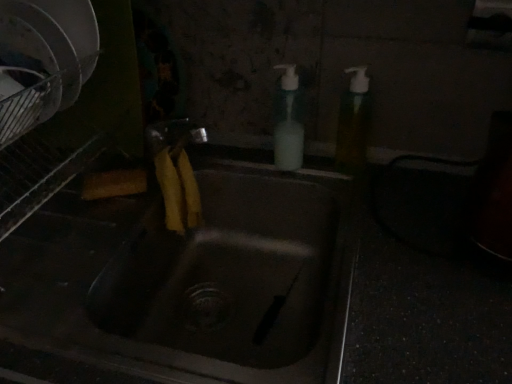
What is the approximate width of translucent plastic soap dispenser at upper right, marked as the 1th soap dispenser in a right-to-left arrangement?

It is 5.98 centimeters.

Image resolution: width=512 pixels, height=384 pixels. In order to click on matte stainless steel sink at center in this screenshot , I will do `click(192, 277)`.

Where is `translucent plastic soap dispenser at upper right, marked as the 1th soap dispenser in a right-to-left arrangement`? This screenshot has width=512, height=384. translucent plastic soap dispenser at upper right, marked as the 1th soap dispenser in a right-to-left arrangement is located at coordinates (353, 123).

Between white plastic soap dispenser at upper center, which appears as the 2th soap dispenser when viewed from the right, and translucent plastic soap dispenser at upper right, which appears as the second soap dispenser when viewed from the left, which one has larger width?

Wider between the two is translucent plastic soap dispenser at upper right, which appears as the second soap dispenser when viewed from the left.

Could you tell me if white plastic soap dispenser at upper center, which appears as the 2th soap dispenser when viewed from the right, is turned towards translucent plastic soap dispenser at upper right, which appears as the second soap dispenser when viewed from the left?

No, white plastic soap dispenser at upper center, which appears as the 2th soap dispenser when viewed from the right, is not turned towards translucent plastic soap dispenser at upper right, which appears as the second soap dispenser when viewed from the left.

Considering the relative sizes of white plastic soap dispenser at upper center, which appears as the 2th soap dispenser when viewed from the right, and translucent plastic soap dispenser at upper right, marked as the 1th soap dispenser in a right-to-left arrangement, in the image provided, is white plastic soap dispenser at upper center, which appears as the 2th soap dispenser when viewed from the right, smaller than translucent plastic soap dispenser at upper right, marked as the 1th soap dispenser in a right-to-left arrangement,?

Yes, white plastic soap dispenser at upper center, which appears as the 2th soap dispenser when viewed from the right, is smaller than translucent plastic soap dispenser at upper right, marked as the 1th soap dispenser in a right-to-left arrangement.

The height and width of the screenshot is (384, 512). What are the coordinates of `soap dispenser located underneath the translucent plastic soap dispenser at upper right, which appears as the second soap dispenser when viewed from the left (from a real-world perspective)` in the screenshot? It's located at (288, 122).

Can you tell me how much translucent plastic soap dispenser at upper right, which appears as the second soap dispenser when viewed from the left, and white plastic soap dispenser at upper center, arranged as the 1th soap dispenser when viewed from the left, differ in facing direction?

The angle between the facing direction of translucent plastic soap dispenser at upper right, which appears as the second soap dispenser when viewed from the left, and the facing direction of white plastic soap dispenser at upper center, arranged as the 1th soap dispenser when viewed from the left, is 0 degrees.

Which is more to the left, translucent plastic soap dispenser at upper right, marked as the 1th soap dispenser in a right-to-left arrangement, or white plastic soap dispenser at upper center, arranged as the 1th soap dispenser when viewed from the left?

Positioned to the left is white plastic soap dispenser at upper center, arranged as the 1th soap dispenser when viewed from the left.

Are translucent plastic soap dispenser at upper right, marked as the 1th soap dispenser in a right-to-left arrangement, and white plastic soap dispenser at upper center, arranged as the 1th soap dispenser when viewed from the left, beside each other?

No, translucent plastic soap dispenser at upper right, marked as the 1th soap dispenser in a right-to-left arrangement, is not next to white plastic soap dispenser at upper center, arranged as the 1th soap dispenser when viewed from the left.

Are matte stainless steel sink at center and translucent plastic soap dispenser at upper right, marked as the 1th soap dispenser in a right-to-left arrangement, beside each other?

They are not placed beside each other.

In the scene shown: Could you measure the distance between matte stainless steel sink at center and translucent plastic soap dispenser at upper right, which appears as the second soap dispenser when viewed from the left?

matte stainless steel sink at center is 12.78 inches from translucent plastic soap dispenser at upper right, which appears as the second soap dispenser when viewed from the left.

Between matte stainless steel sink at center and translucent plastic soap dispenser at upper right, marked as the 1th soap dispenser in a right-to-left arrangement, which one appears on the left side from the viewer's perspective?

matte stainless steel sink at center.

How much distance is there between translucent plastic soap dispenser at upper right, which appears as the second soap dispenser when viewed from the left, and matte stainless steel sink at center?

translucent plastic soap dispenser at upper right, which appears as the second soap dispenser when viewed from the left, and matte stainless steel sink at center are 12.78 inches apart.

Which is further, (362,110) or (318,291)?

The point (362,110) is behind.

Considering the sizes of translucent plastic soap dispenser at upper right, which appears as the second soap dispenser when viewed from the left, and matte stainless steel sink at center in the image, is translucent plastic soap dispenser at upper right, which appears as the second soap dispenser when viewed from the left, taller or shorter than matte stainless steel sink at center?

Considering their sizes, translucent plastic soap dispenser at upper right, which appears as the second soap dispenser when viewed from the left, has less height than matte stainless steel sink at center.

Looking at this image, can you tell me how much translucent plastic soap dispenser at upper right, which appears as the second soap dispenser when viewed from the left, and matte stainless steel sink at center differ in facing direction?

They differ by 0.00215 degrees in their facing directions.

Locate an element on the screen. sink below the white plastic soap dispenser at upper center, arranged as the 1th soap dispenser when viewed from the left (from a real-world perspective) is located at coordinates (192, 277).

How distant is white plastic soap dispenser at upper center, which appears as the 2th soap dispenser when viewed from the right, from matte stainless steel sink at center?

A distance of 26.40 centimeters exists between white plastic soap dispenser at upper center, which appears as the 2th soap dispenser when viewed from the right, and matte stainless steel sink at center.

From a real-world perspective, is white plastic soap dispenser at upper center, which appears as the 2th soap dispenser when viewed from the right, physically above matte stainless steel sink at center?

Indeed, from a real-world perspective, white plastic soap dispenser at upper center, which appears as the 2th soap dispenser when viewed from the right, stands above matte stainless steel sink at center.

Can we say white plastic soap dispenser at upper center, arranged as the 1th soap dispenser when viewed from the left, lies outside matte stainless steel sink at center?

Indeed, white plastic soap dispenser at upper center, arranged as the 1th soap dispenser when viewed from the left, is completely outside matte stainless steel sink at center.

From their relative heights in the image, would you say matte stainless steel sink at center is taller or shorter than white plastic soap dispenser at upper center, arranged as the 1th soap dispenser when viewed from the left?

In the image, matte stainless steel sink at center appears to be taller than white plastic soap dispenser at upper center, arranged as the 1th soap dispenser when viewed from the left.

Is matte stainless steel sink at center at the left side of white plastic soap dispenser at upper center, arranged as the 1th soap dispenser when viewed from the left?

Yes, matte stainless steel sink at center is to the left of white plastic soap dispenser at upper center, arranged as the 1th soap dispenser when viewed from the left.

Between matte stainless steel sink at center and white plastic soap dispenser at upper center, arranged as the 1th soap dispenser when viewed from the left, which one is positioned in front?

matte stainless steel sink at center is more forward.

Considering the points (44, 306) and (281, 83), which point is in front, point (44, 306) or point (281, 83)?

The point (44, 306) is closer.

What are the coordinates of `soap dispenser above the translucent plastic soap dispenser at upper right, which appears as the second soap dispenser when viewed from the left (from the image's perspective)` in the screenshot? It's located at tap(288, 122).

Locate an element on the screen. soap dispenser on the right side of white plastic soap dispenser at upper center, arranged as the 1th soap dispenser when viewed from the left is located at coordinates click(353, 123).

Looking at the image, which one is located closer to matte stainless steel sink at center, white plastic soap dispenser at upper center, which appears as the 2th soap dispenser when viewed from the right, or translucent plastic soap dispenser at upper right, which appears as the second soap dispenser when viewed from the left?

The object closer to matte stainless steel sink at center is white plastic soap dispenser at upper center, which appears as the 2th soap dispenser when viewed from the right.

Which object lies nearer to the anchor point white plastic soap dispenser at upper center, which appears as the 2th soap dispenser when viewed from the right, matte stainless steel sink at center or translucent plastic soap dispenser at upper right, marked as the 1th soap dispenser in a right-to-left arrangement?

Based on the image, translucent plastic soap dispenser at upper right, marked as the 1th soap dispenser in a right-to-left arrangement, appears to be nearer to white plastic soap dispenser at upper center, which appears as the 2th soap dispenser when viewed from the right.

Considering their positions, is translucent plastic soap dispenser at upper right, which appears as the second soap dispenser when viewed from the left, positioned closer to white plastic soap dispenser at upper center, which appears as the 2th soap dispenser when viewed from the right, than matte stainless steel sink at center?

translucent plastic soap dispenser at upper right, which appears as the second soap dispenser when viewed from the left, lies closer to white plastic soap dispenser at upper center, which appears as the 2th soap dispenser when viewed from the right, than the other object.

Based on their spatial positions, is matte stainless steel sink at center or white plastic soap dispenser at upper center, which appears as the 2th soap dispenser when viewed from the right, closer to translucent plastic soap dispenser at upper right, which appears as the second soap dispenser when viewed from the left?

The object closer to translucent plastic soap dispenser at upper right, which appears as the second soap dispenser when viewed from the left, is white plastic soap dispenser at upper center, which appears as the 2th soap dispenser when viewed from the right.

Estimate the real-world distances between objects in this image. Which object is further from translucent plastic soap dispenser at upper right, marked as the 1th soap dispenser in a right-to-left arrangement, white plastic soap dispenser at upper center, which appears as the 2th soap dispenser when viewed from the right, or matte stainless steel sink at center?

matte stainless steel sink at center is positioned further to the anchor translucent plastic soap dispenser at upper right, marked as the 1th soap dispenser in a right-to-left arrangement.

From the image, which object appears to be nearer to matte stainless steel sink at center, translucent plastic soap dispenser at upper right, which appears as the second soap dispenser when viewed from the left, or white plastic soap dispenser at upper center, which appears as the 2th soap dispenser when viewed from the right?

white plastic soap dispenser at upper center, which appears as the 2th soap dispenser when viewed from the right, is closer to matte stainless steel sink at center.

The height and width of the screenshot is (384, 512). Find the location of `soap dispenser between white plastic soap dispenser at upper center, arranged as the 1th soap dispenser when viewed from the left, and matte stainless steel sink at center in the up-down direction`. soap dispenser between white plastic soap dispenser at upper center, arranged as the 1th soap dispenser when viewed from the left, and matte stainless steel sink at center in the up-down direction is located at coordinates (353, 123).